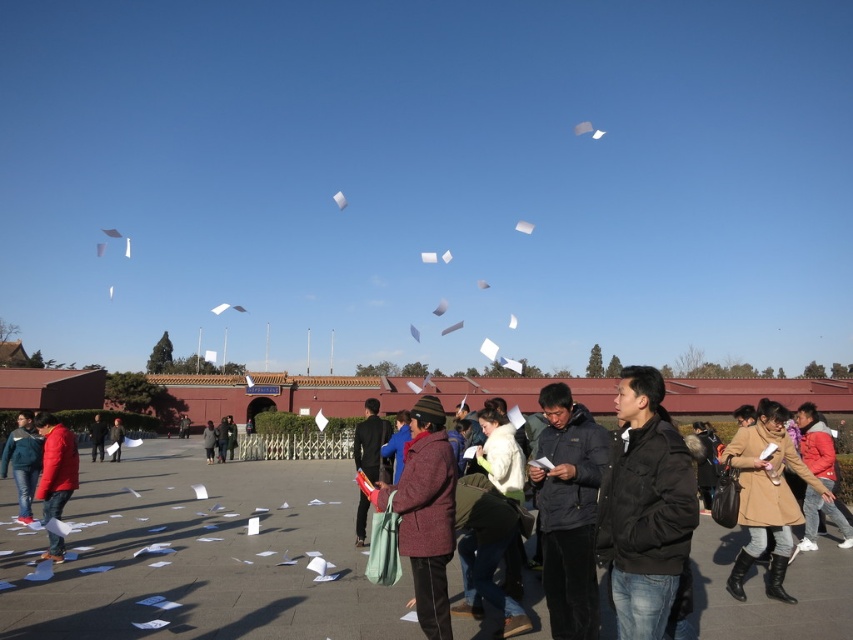
Question: Does matte red jacket at lower left appear under matte blue jacket at lower left?

Choices:
 (A) no
 (B) yes

Answer: (A)

Question: Estimate the real-world distances between objects in this image. Which object is farther from the dark brown leather jacket at center?

Choices:
 (A) brown leather coat at lower right
 (B) black matte jacket at lower right
 (C) matte red jacket at lower left

Answer: (A)

Question: Which is nearer to the dark gray jacket at center?

Choices:
 (A) black matte jacket at lower right
 (B) dark brown leather jacket at center

Answer: (B)

Question: Is black matte jacket at lower right smaller than dark brown leather jacket at center?

Choices:
 (A) yes
 (B) no

Answer: (A)

Question: Does matte red jacket at lower left appear under dark brown leather jacket at center?

Choices:
 (A) yes
 (B) no

Answer: (B)

Question: Among these objects, which one is farthest from the camera?

Choices:
 (A) black matte jacket at lower right
 (B) dark gray jacket at center

Answer: (B)